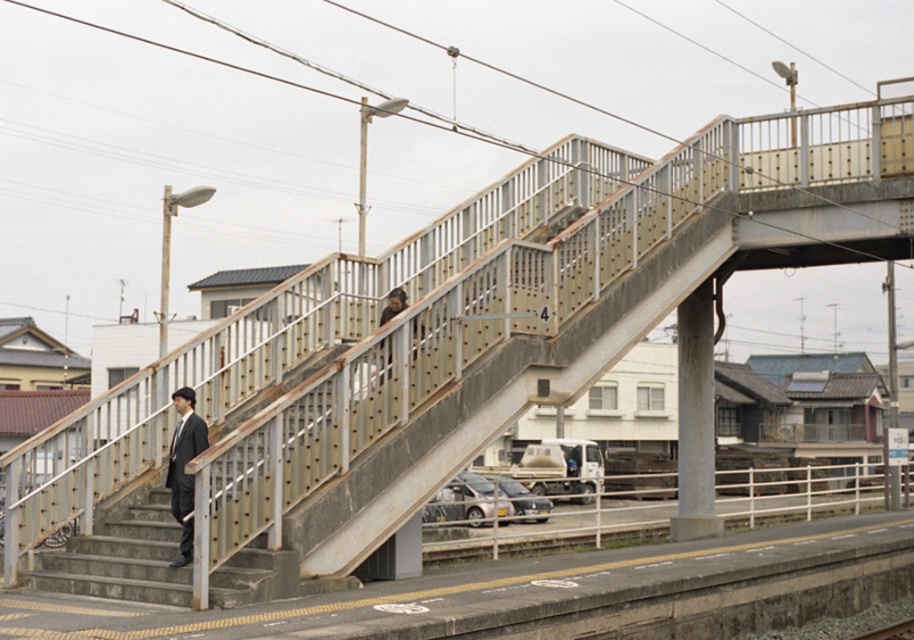
You are standing at the train station platform and want to know how far the point at coordinates (181,394) is from your current position. Can you determine the distance?

The point at coordinates (181,394) is 15.43 meters away from your current position.

You are a passenger at the train station. You need to reach the pedestrian overpass to catch your train. You are currently standing near the dark brown leather jacket at center. Which direction should you move to reach the rusty metal stairs at lower left?

The rusty metal stairs at lower left are to the left of the dark brown leather jacket at center, so you should move to the left to reach them.

You are standing on the train station platform and want to take a photo. There are two points you want to focus on, point [119,566] and point [384,316]. Which point should you focus on first to ensure it appears larger in your photo?

Point [119,566] is closer to the camera than point [384,316], so focusing on point [119,566] first will make it appear larger in the photo.